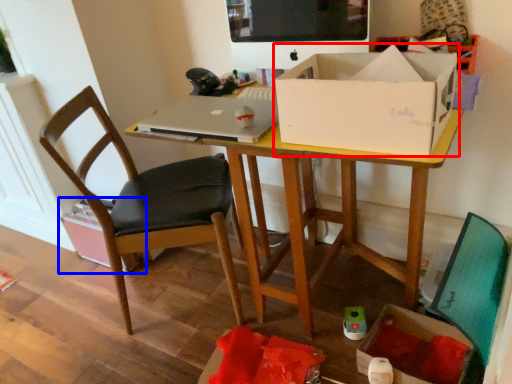
Question: Which object appears closest to the camera in this image, box (highlighted by a red box) or cardboard box (highlighted by a blue box)?

Choices:
 (A) box
 (B) cardboard box

Answer: (A)